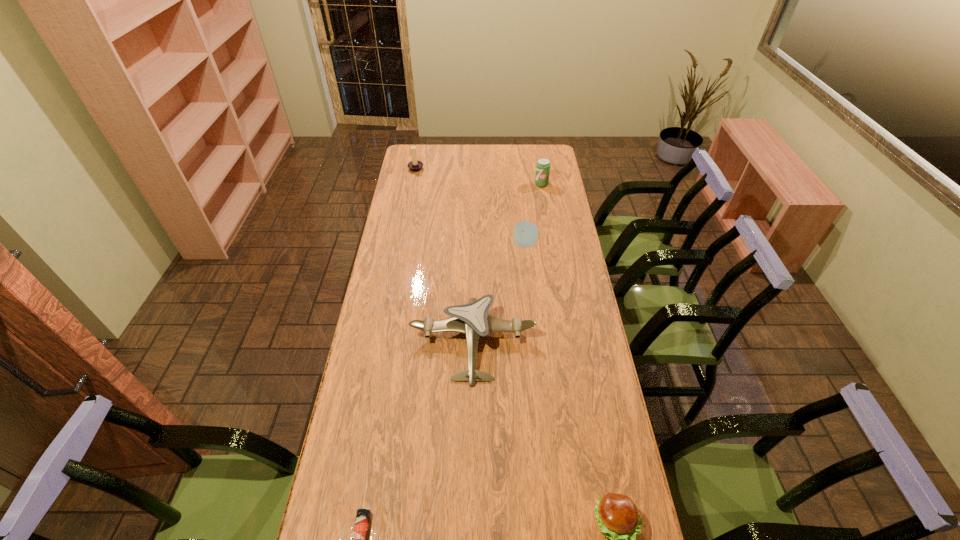
Where is `candle holder`? candle holder is located at coordinates (415, 166).

The image size is (960, 540). What are the coordinates of `soda` in the screenshot? It's located at (543, 165).

I want to click on the fourth nearest object, so click(x=525, y=233).

The width and height of the screenshot is (960, 540). Find the location of `drone`. drone is located at coordinates (472, 319).

Locate an element on the screen. blank space located on the wick of the farthest object is located at coordinates (435, 168).

Identify the location of vacant space located on the left of the fifth nearest object. (470, 184).

Locate an element on the screen. The image size is (960, 540). free location located 0.140m on the left of the fourth nearest object is located at coordinates (481, 244).

The width and height of the screenshot is (960, 540). Find the location of `free space located on the front-facing side of the drone`. free space located on the front-facing side of the drone is located at coordinates (470, 488).

The width and height of the screenshot is (960, 540). Identify the location of object present at the far edge. (415, 166).

Identify the location of object at the left edge. (415, 166).